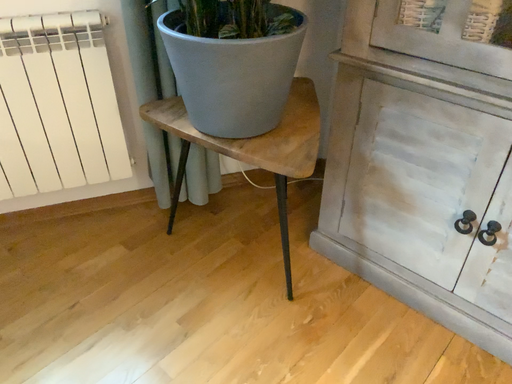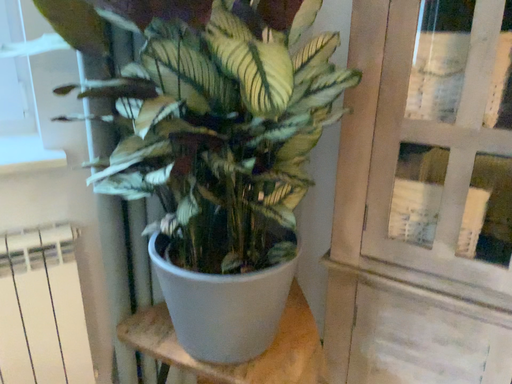
Question: How did the camera likely rotate when shooting the video?

Choices:
 (A) rotated downward
 (B) rotated upward

Answer: (B)